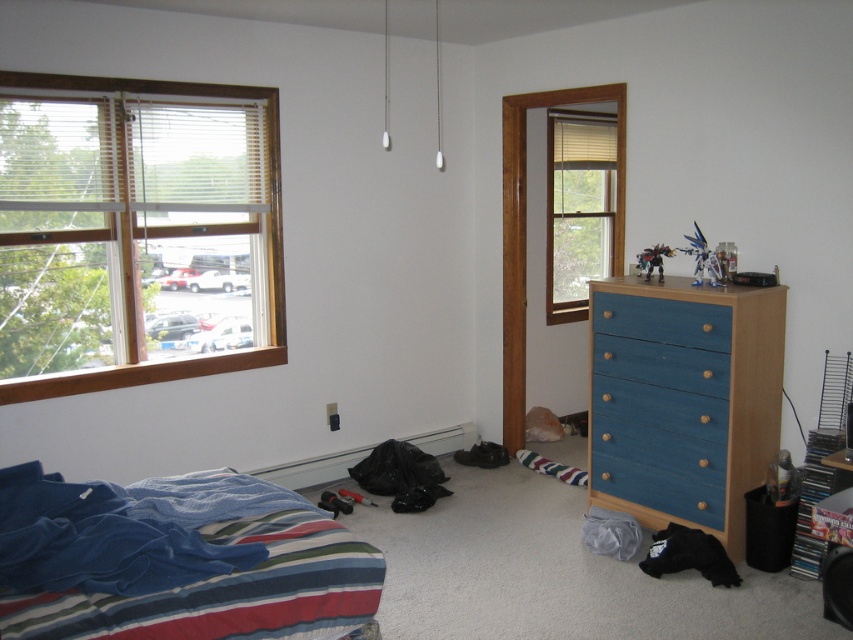
Question: Can you confirm if matte wood window at center right is positioned above blue painted wood drawer at center right?

Choices:
 (A) no
 (B) yes

Answer: (B)

Question: Can you confirm if blue wood dresser at right is positioned below blue painted wood drawer at center right?

Choices:
 (A) no
 (B) yes

Answer: (B)

Question: Which point appears closest to the camera in this image?

Choices:
 (A) (144, 282)
 (B) (715, 310)
 (C) (631, 321)
 (D) (553, 145)

Answer: (B)

Question: Considering the real-world distances, which object is closest to the wooden frame window at left?

Choices:
 (A) matte wood window at center right
 (B) blue cotton bedspread at lower left
 (C) blue wood dresser at right

Answer: (B)

Question: In this image, where is wooden frame window at left located relative to blue cotton bedspread at lower left?

Choices:
 (A) left
 (B) right

Answer: (A)

Question: Based on their relative distances, which object is farther from the blue wood dresser at right?

Choices:
 (A) wooden frame window at left
 (B) blue painted wood drawer at center right
 (C) matte wood window at center right
 (D) blue cotton bedspread at lower left

Answer: (A)